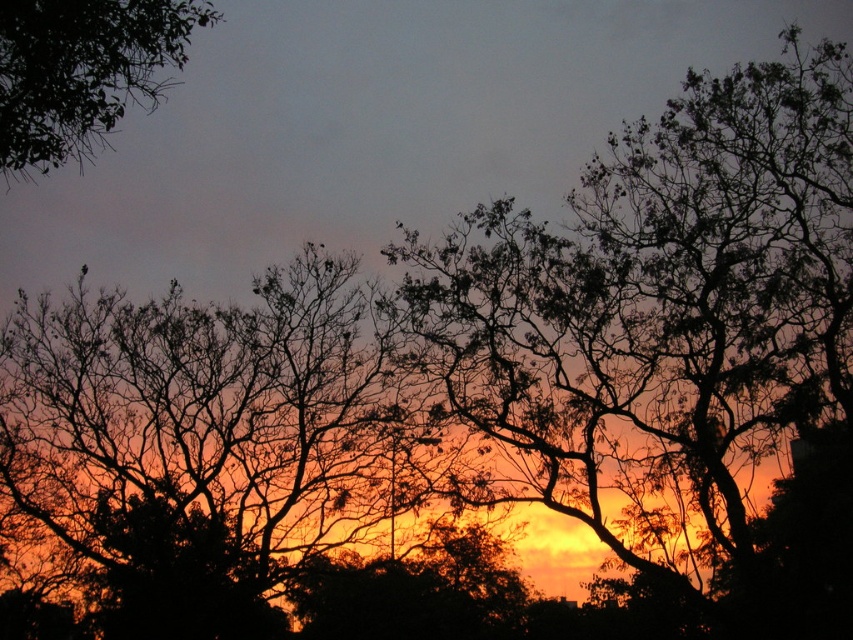
Question: Which of the following is the farthest from the observer?

Choices:
 (A) silhouette tree at upper right
 (B) green leafy tree at upper left

Answer: (A)

Question: Which point is farther from the camera taking this photo?

Choices:
 (A) (700, 419)
 (B) (9, 51)

Answer: (A)

Question: Can you confirm if silhouette tree at upper right is positioned to the left of green leafy tree at upper left?

Choices:
 (A) yes
 (B) no

Answer: (B)

Question: Which point is closer to the camera?

Choices:
 (A) (97, 26)
 (B) (766, 545)

Answer: (A)

Question: From the image, what is the correct spatial relationship of silhouette tree at upper right in relation to green leafy tree at upper left?

Choices:
 (A) below
 (B) above

Answer: (A)

Question: Does silhouette tree at upper right lie behind green leafy tree at upper left?

Choices:
 (A) yes
 (B) no

Answer: (A)